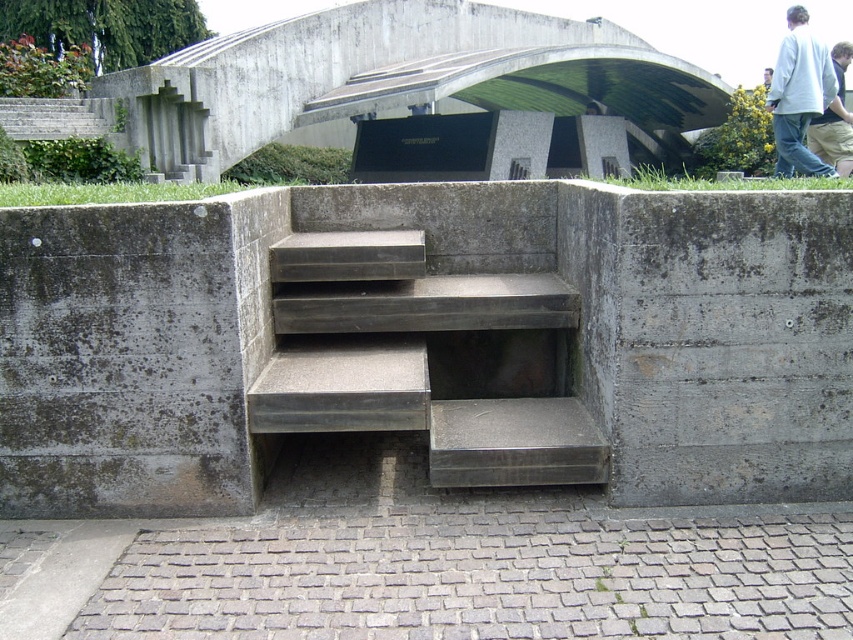
You are standing in front of the gray concrete stairs at center and want to place a small potted plant between them and the light blue jeans at upper right. Can you do this without the plant being in front of the stairs?

The gray concrete stairs at center are closer to the viewer than the light blue jeans at upper right. Therefore, placing the potted plant between them would require positioning it behind the stairs, which might not be visible from your current viewpoint. Alternatively, if you place it in front of the stairs, it would block the view of the stairs themselves. Since the question specifies avoiding placement in front of the stairs, the plant cannot be placed between them and the jeans without being obscured by,

You are a painter standing at the gray concrete stairs at center and need to reach the white cotton shirt at upper right to touch it. Can you do so without moving from your current position?

The distance between the gray concrete stairs at center and the white cotton shirt at upper right is 4.58 meters, so you cannot reach the white cotton shirt at upper right without moving from your current position.

In the scene shown: You are standing in front of the architectural structure described in the scene. There is a point labeled as point (427, 358). Can you tell me what object this point is located on?

The point (427, 358) is located on the gray concrete stairs at center.